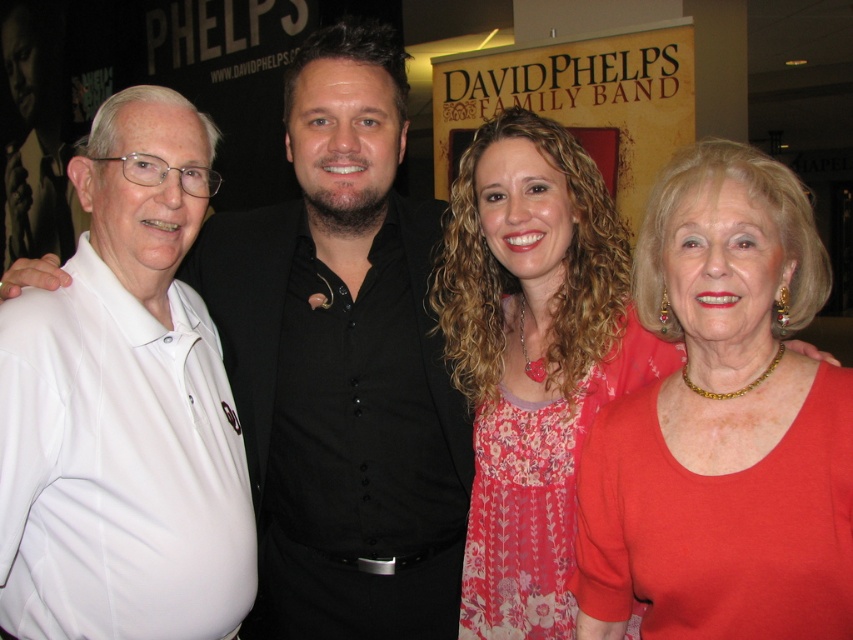
Image resolution: width=853 pixels, height=640 pixels. What are the coordinates of `white matte shirt at left` in the screenshot? It's located at [x=343, y=362].

Consider the image. Can you confirm if white matte shirt at left is shorter than white cotton polo shirt at left?

No, white matte shirt at left is not shorter than white cotton polo shirt at left.

Between point (403, 236) and point (175, 156), which one is positioned behind?

The point (403, 236) is behind.

Locate an element on the screen. The width and height of the screenshot is (853, 640). white matte shirt at left is located at coordinates (343, 362).

This screenshot has width=853, height=640. What do you see at coordinates (343, 362) in the screenshot?
I see `white matte shirt at left` at bounding box center [343, 362].

How far apart are white matte shirt at left and matte gold necklace at center?

The distance of white matte shirt at left from matte gold necklace at center is 67.30 centimeters.

Which is behind, point (380, 625) or point (743, 180)?

Positioned behind is point (380, 625).

Locate an element on the screen. white matte shirt at left is located at coordinates (343, 362).

Can you confirm if matte gold necklace at center is smaller than white cotton polo shirt at left?

No, matte gold necklace at center is not smaller than white cotton polo shirt at left.

Which is below, matte gold necklace at center or white cotton polo shirt at left?

Positioned lower is matte gold necklace at center.

Locate an element on the screen. Image resolution: width=853 pixels, height=640 pixels. matte gold necklace at center is located at coordinates point(722,424).